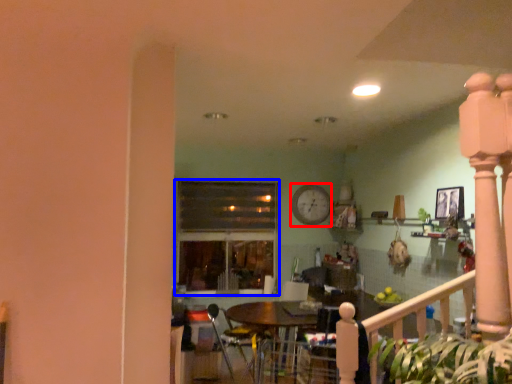
Question: Which point is closer to the camera, clock (highlighted by a red box) or window (highlighted by a blue box)?

Choices:
 (A) clock
 (B) window

Answer: (B)